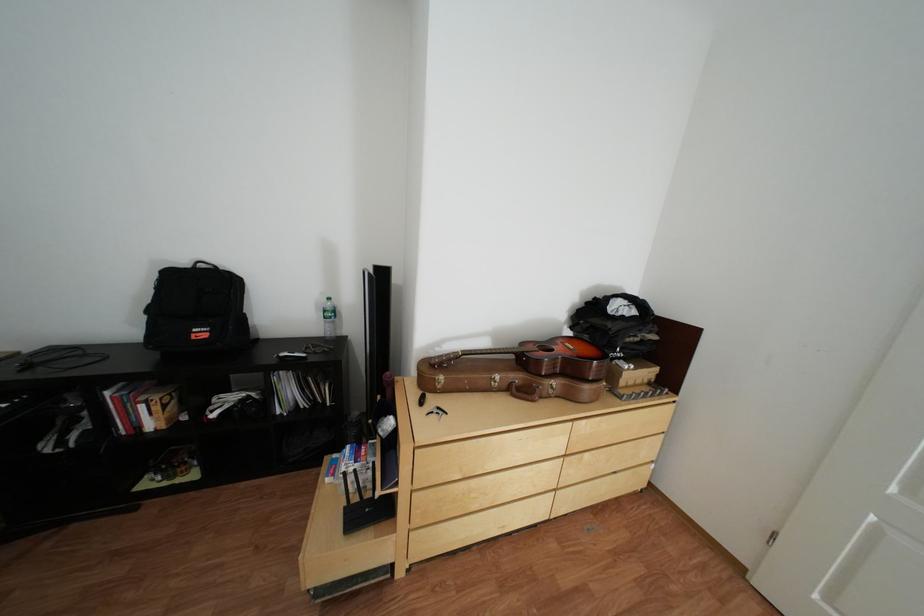
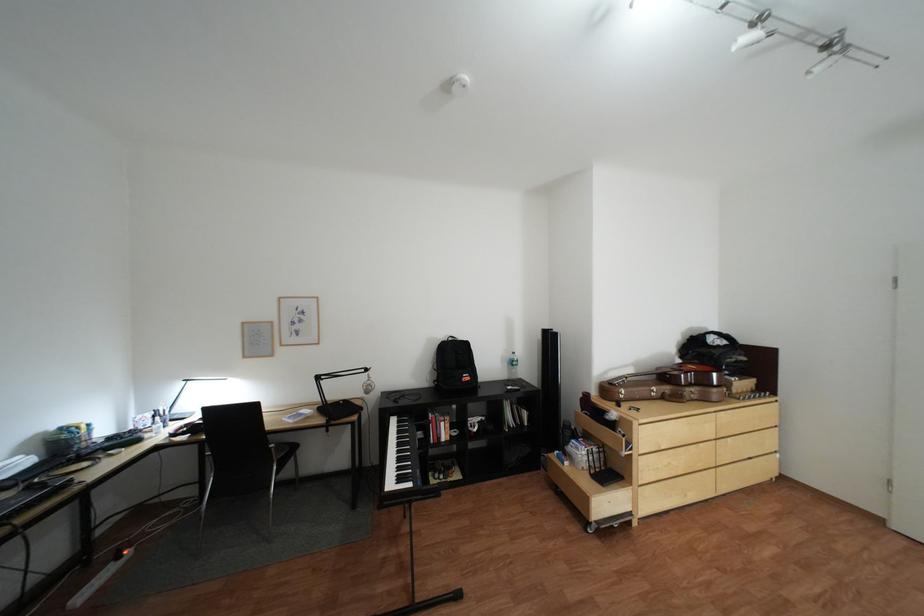
Locate, in the second image, the point that corresponds to point 563,383 in the first image.

(703, 391)